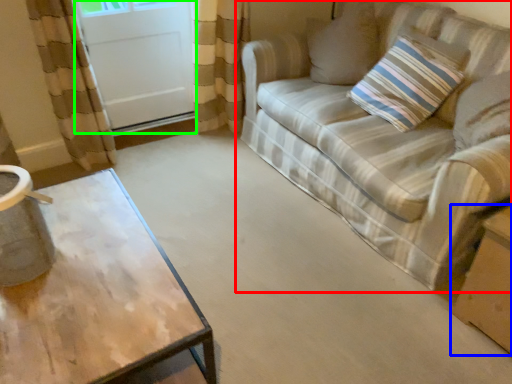
Question: Which object is the farthest from studio couch (highlighted by a red box)? Choose among these: cardboard box (highlighted by a blue box) or screen door (highlighted by a green box).

Choices:
 (A) cardboard box
 (B) screen door

Answer: (B)